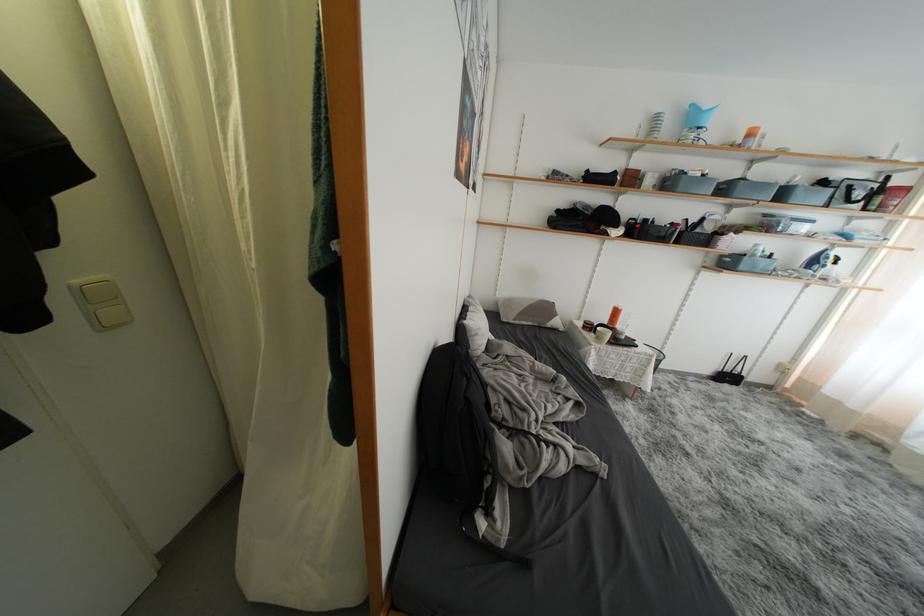
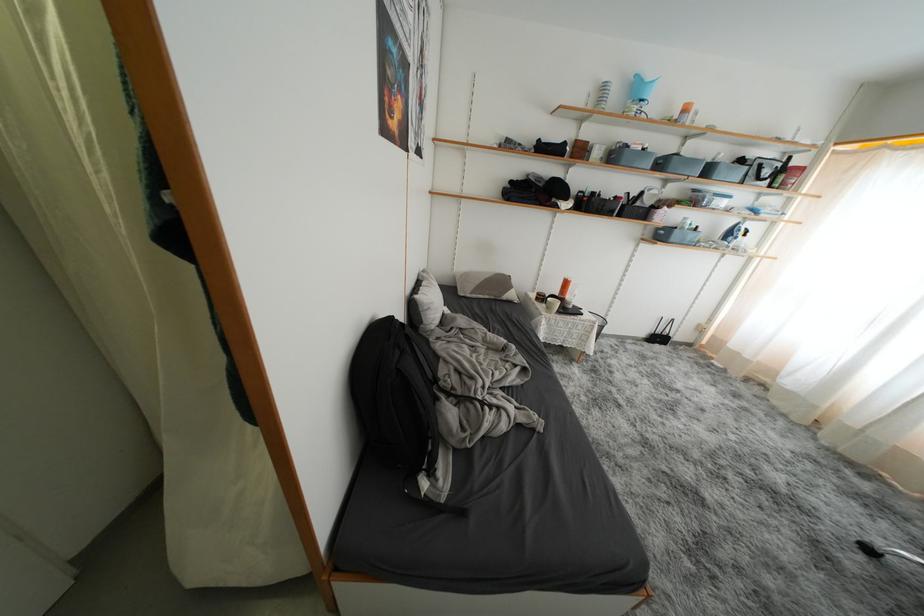
Locate, in the second image, the point that corresponds to the point at 732,193 in the first image.

(667, 168)